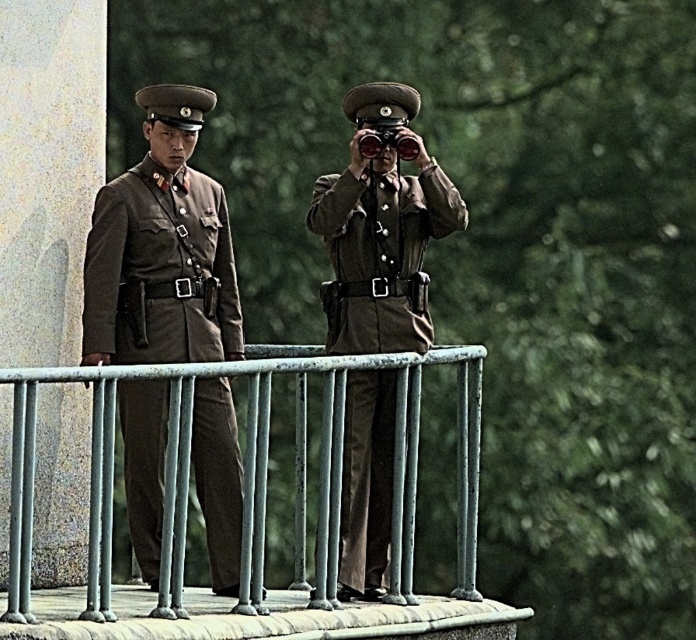
Question: Estimate the real-world distances between objects in this image. Which object is closer to the matte black binoculars at center?

Choices:
 (A) matte olive-green uniform at left
 (B) metallic gray fence at center

Answer: (A)

Question: Does metallic gray fence at center come in front of matte brown uniform at center?

Choices:
 (A) no
 (B) yes

Answer: (B)

Question: Which object appears closest to the camera in this image?

Choices:
 (A) matte brown uniform at center
 (B) matte black binoculars at center
 (C) matte olive-green uniform at left
 (D) metallic gray fence at center

Answer: (D)

Question: Where is metallic gray fence at center located in relation to matte olive-green uniform at left in the image?

Choices:
 (A) above
 (B) below

Answer: (B)

Question: Does metallic gray fence at center appear on the left side of matte olive-green uniform at left?

Choices:
 (A) yes
 (B) no

Answer: (B)

Question: Estimate the real-world distances between objects in this image. Which object is closer to the metallic gray fence at center?

Choices:
 (A) matte black binoculars at center
 (B) matte brown uniform at center
 (C) matte olive-green uniform at left

Answer: (A)